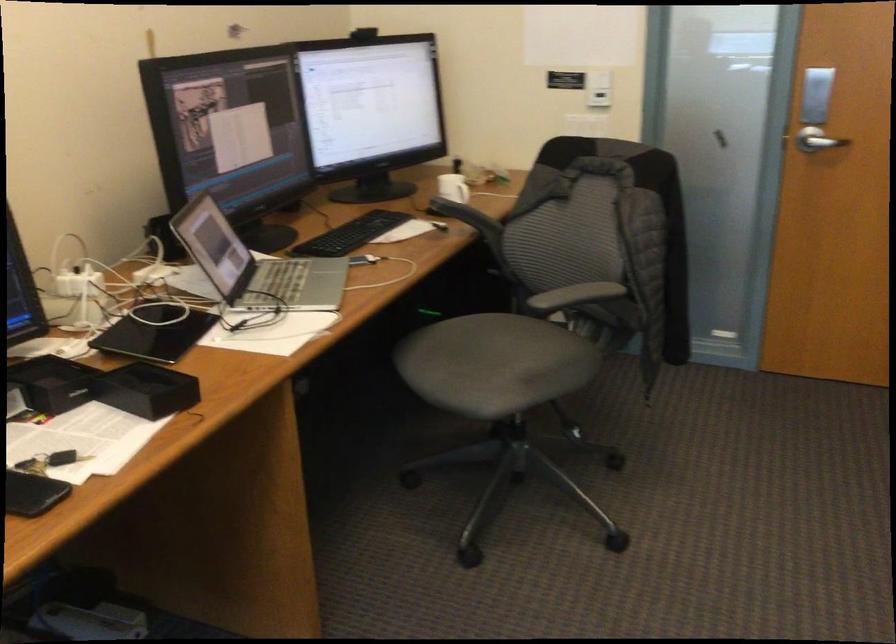
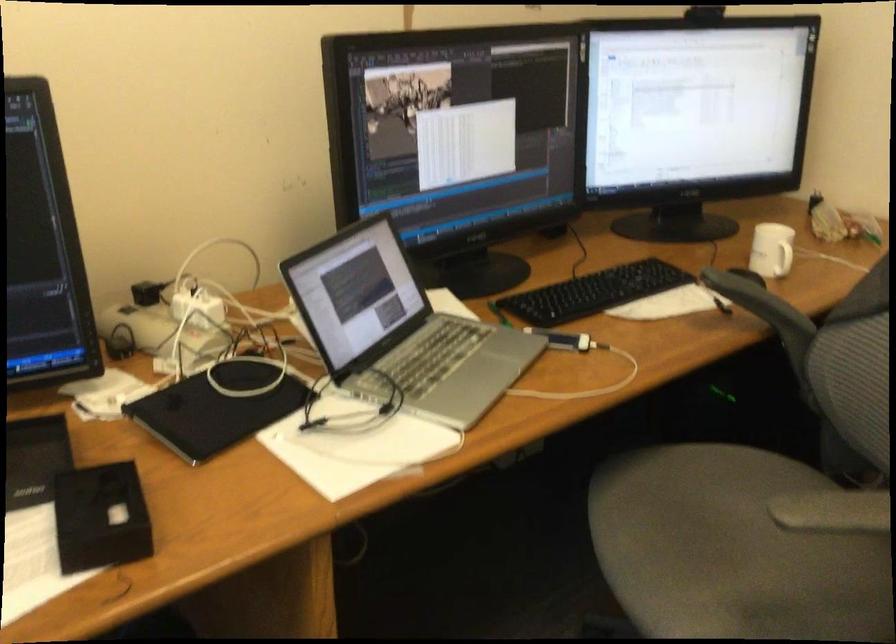
Find the pixel in the second image that matches point 502,360 in the first image.

(733, 550)